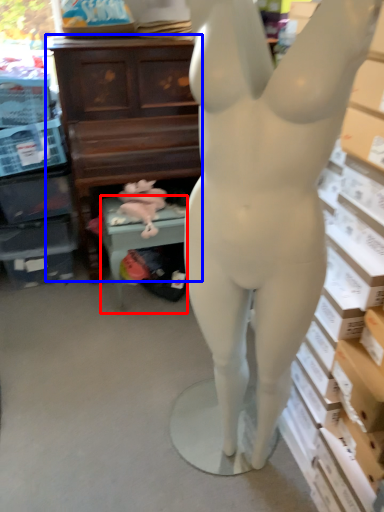
Question: Which object appears farthest to the camera in this image, furniture (highlighted by a red box) or entertainment center (highlighted by a blue box)?

Choices:
 (A) furniture
 (B) entertainment center

Answer: (A)